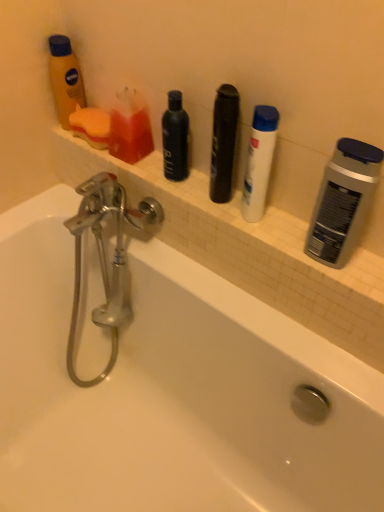
Question: Considering the relative sizes of matte orange lotion at upper left, marked as the third toiletry in a right-to-left arrangement, and white matte shampoo at center, the third toiletry in the left-to-right sequence, in the image provided, is matte orange lotion at upper left, marked as the third toiletry in a right-to-left arrangement, bigger than white matte shampoo at center, the third toiletry in the left-to-right sequence,?

Choices:
 (A) yes
 (B) no

Answer: (B)

Question: Does matte orange lotion at upper left, marked as the third toiletry in a right-to-left arrangement, come behind white matte shampoo at center, positioned as the first toiletry in right-to-left order?

Choices:
 (A) no
 (B) yes

Answer: (B)

Question: Considering the relative sizes of matte orange lotion at upper left, which is the 1th toiletry in left-to-right order, and white matte shampoo at center, positioned as the first toiletry in right-to-left order, in the image provided, is matte orange lotion at upper left, which is the 1th toiletry in left-to-right order, thinner than white matte shampoo at center, positioned as the first toiletry in right-to-left order,?

Choices:
 (A) yes
 (B) no

Answer: (B)

Question: Is matte orange lotion at upper left, marked as the third toiletry in a right-to-left arrangement, aimed at white matte shampoo at center, the third toiletry in the left-to-right sequence?

Choices:
 (A) yes
 (B) no

Answer: (B)

Question: Would you say white matte shampoo at center, positioned as the first toiletry in right-to-left order, is part of matte orange lotion at upper left, which is the 1th toiletry in left-to-right order,'s contents?

Choices:
 (A) yes
 (B) no

Answer: (B)

Question: From the image's perspective, is matte orange lotion at upper left, which is the 1th toiletry in left-to-right order, above white matte shampoo at center, positioned as the first toiletry in right-to-left order?

Choices:
 (A) no
 (B) yes

Answer: (B)

Question: Could you tell me if beige tile ledge at upper center is turned towards white matte shampoo at center, positioned as the first toiletry in right-to-left order?

Choices:
 (A) no
 (B) yes

Answer: (A)

Question: From a real-world perspective, is beige tile ledge at upper center below white matte shampoo at center, the third toiletry in the left-to-right sequence?

Choices:
 (A) yes
 (B) no

Answer: (A)

Question: Does beige tile ledge at upper center appear on the right side of white matte shampoo at center, positioned as the first toiletry in right-to-left order?

Choices:
 (A) no
 (B) yes

Answer: (A)

Question: Does beige tile ledge at upper center have a greater width compared to white matte shampoo at center, the third toiletry in the left-to-right sequence?

Choices:
 (A) no
 (B) yes

Answer: (B)

Question: Would you say beige tile ledge at upper center is outside white matte shampoo at center, the third toiletry in the left-to-right sequence?

Choices:
 (A) yes
 (B) no

Answer: (A)

Question: Is there a large distance between beige tile ledge at upper center and white matte shampoo at center, the third toiletry in the left-to-right sequence?

Choices:
 (A) yes
 (B) no

Answer: (B)

Question: Is white matte shampoo at center, the third toiletry in the left-to-right sequence, at the left side of translucent plastic soap at upper left, placed as the second toiletry when sorted from right to left?

Choices:
 (A) no
 (B) yes

Answer: (A)